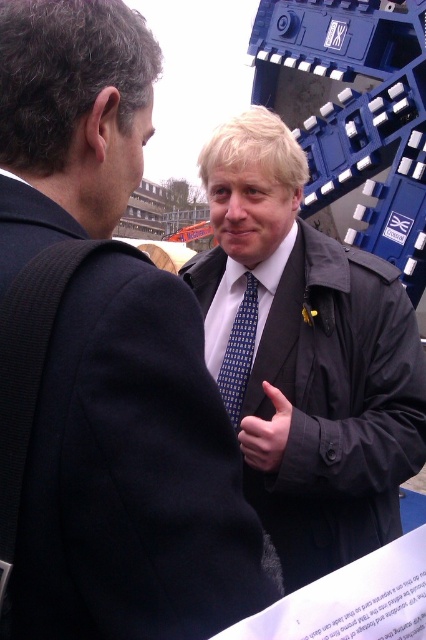
You are a photographer trying to capture a candid shot of the blue dotted tie at center and the matte black hand at center. To ensure both are in focus, you need to know their relative positions. Which object is located to the left of the other?

The blue dotted tie at center is positioned on the left side of matte black hand at center.

You are a photographer standing 10 meters away from the scene. You want to capture both the blue dotted tie at center and the matte black hand at center in a single photo without moving your camera. Can you do it?

The blue dotted tie at center and matte black hand at center are 7.95 meters apart from each other. Since you are 10 meters away from the scene, the distance between the two objects is less than your distance from the scene, so they can both fit in the camera frame without moving it.

You are standing in front of the large blue Crossrail structure and see two points marked on it. One is at coordinate point (239, 332) and the other at point (244, 460). Which point is closer to you?

Point (239, 332) is closer to you because it is further to the viewer than point (244, 460).